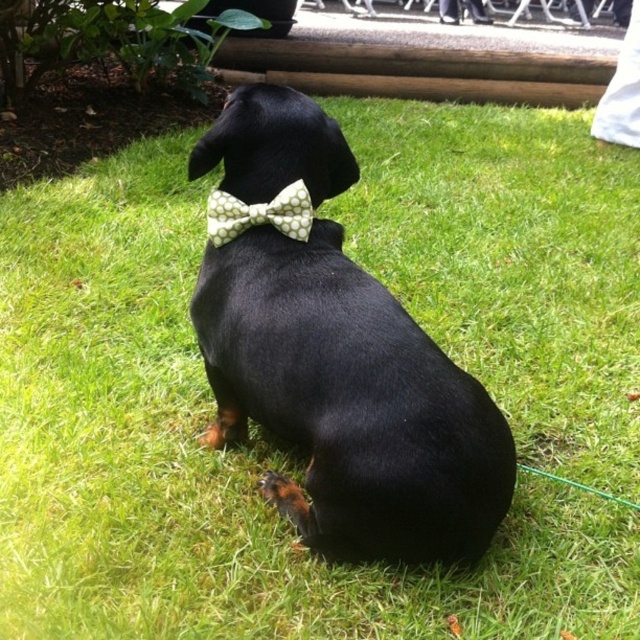
Based on the photo, is black matte bow tie at center to the left of green dotted bow tie at center from the viewer's perspective?

In fact, black matte bow tie at center is to the right of green dotted bow tie at center.

Can you confirm if black matte bow tie at center is bigger than green dotted bow tie at center?

Indeed, black matte bow tie at center has a larger size compared to green dotted bow tie at center.

The width and height of the screenshot is (640, 640). What are the coordinates of `black matte bow tie at center` in the screenshot? It's located at point(349,401).